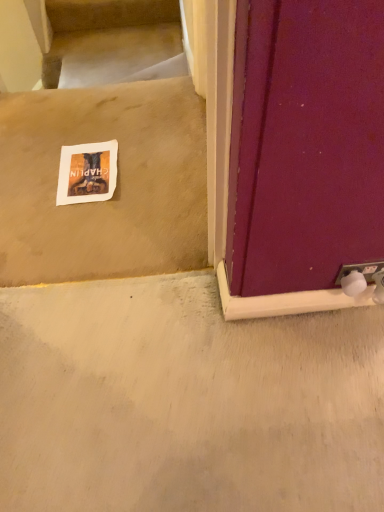
The height and width of the screenshot is (512, 384). I want to click on white paper at center, so click(x=87, y=173).

The width and height of the screenshot is (384, 512). What do you see at coordinates (87, 173) in the screenshot? I see `white paper at center` at bounding box center [87, 173].

The width and height of the screenshot is (384, 512). What do you see at coordinates (113, 42) in the screenshot?
I see `beige carpet at upper left` at bounding box center [113, 42].

The height and width of the screenshot is (512, 384). Identify the location of beige carpet at upper left. (113, 42).

This screenshot has height=512, width=384. In order to click on white paper at center in this screenshot , I will do `click(87, 173)`.

Is beige carpet at upper left at the right side of white paper at center?

In fact, beige carpet at upper left is to the left of white paper at center.

Is beige carpet at upper left further to camera compared to white paper at center?

Yes, beige carpet at upper left is further from the viewer.

Does point (89, 32) appear closer or farther from the camera than point (85, 183)?

Point (89, 32) is farther from the camera than point (85, 183).

From the image's perspective, is beige carpet at upper left on top of white paper at center?

Yes.

From a real-world perspective, is beige carpet at upper left over white paper at center?

Actually, beige carpet at upper left is physically below white paper at center in the real world.

Between beige carpet at upper left and white paper at center, which one has smaller width?

With smaller width is white paper at center.

Looking at this image, considering the relative sizes of beige carpet at upper left and white paper at center in the image provided, is beige carpet at upper left taller than white paper at center?

Yes.

Considering the relative sizes of beige carpet at upper left and white paper at center in the image provided, is beige carpet at upper left bigger than white paper at center?

Correct, beige carpet at upper left is larger in size than white paper at center.

Is beige carpet at upper left located outside white paper at center?

beige carpet at upper left lies outside white paper at center's area.

Is there a large distance between beige carpet at upper left and white paper at center?

Yes.

Is beige carpet at upper left facing away from white paper at center?

No, beige carpet at upper left is not facing the opposite direction of white paper at center.

Locate an element on the screen. This screenshot has height=512, width=384. postcard on the right of beige carpet at upper left is located at coordinates (87, 173).

From the picture: Considering the positions of objects white paper at center and beige carpet at upper left in the image provided, who is more to the left, white paper at center or beige carpet at upper left?

From the viewer's perspective, beige carpet at upper left appears more on the left side.

Is white paper at center in front of beige carpet at upper left?

Yes, the depth of white paper at center is less than that of beige carpet at upper left.

Which is more distant, (113, 180) or (59, 34)?

The point (59, 34) is more distant.

From the image's perspective, which object appears higher, white paper at center or beige carpet at upper left?

beige carpet at upper left is shown above in the image.

From a real-world perspective, who is located lower, white paper at center or beige carpet at upper left?

beige carpet at upper left.

Looking at their sizes, would you say white paper at center is wider or thinner than beige carpet at upper left?

In the image, white paper at center appears to be more narrow than beige carpet at upper left.

From the picture: From their relative heights in the image, would you say white paper at center is taller or shorter than beige carpet at upper left?

white paper at center is shorter than beige carpet at upper left.

In terms of size, does white paper at center appear bigger or smaller than beige carpet at upper left?

In the image, white paper at center appears to be smaller than beige carpet at upper left.

Would you say white paper at center is inside or outside beige carpet at upper left?

white paper at center is spatially situated outside beige carpet at upper left.

From the picture: Is white paper at center not near beige carpet at upper left?

Absolutely, white paper at center is distant from beige carpet at upper left.

Is white paper at center looking in the opposite direction of beige carpet at upper left?

No, white paper at center is not facing away from beige carpet at upper left.

How many degrees apart are the facing directions of white paper at center and beige carpet at upper left?

The facing directions of white paper at center and beige carpet at upper left are 92.6 degrees apart.

How distant is white paper at center from beige carpet at upper left?

They are 4.01 feet apart.

Find the location of a particular element. The image size is (384, 512). stairwell to the left of white paper at center is located at coordinates (113, 42).

Find the location of `stairwell behind the white paper at center`. stairwell behind the white paper at center is located at coordinates (113, 42).

Find the location of a particular element. stairwell above the white paper at center (from the image's perspective) is located at coordinates (113, 42).